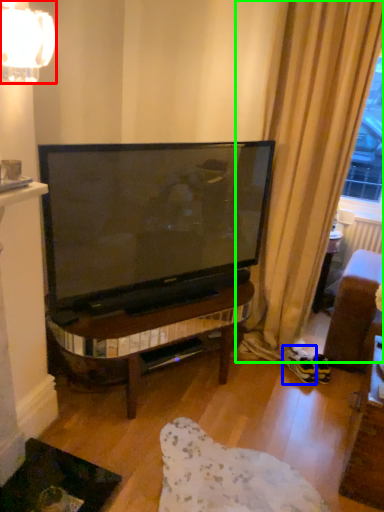
Question: Estimate the real-world distances between objects in this image. Which object is farther from lamp (highlighted by a red box), footwear (highlighted by a blue box) or curtain (highlighted by a green box)?

Choices:
 (A) footwear
 (B) curtain

Answer: (A)